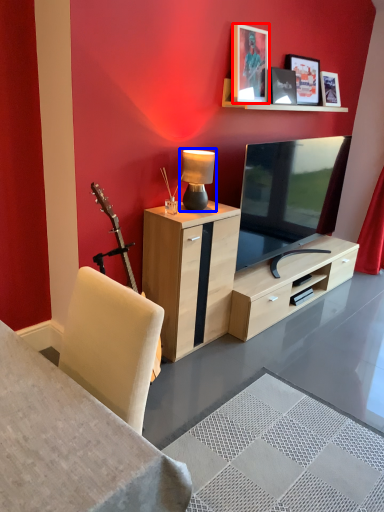
Question: Which of the following is the closest to the observer, picture frame (highlighted by a red box) or table lamp (highlighted by a blue box)?

Choices:
 (A) picture frame
 (B) table lamp

Answer: (B)